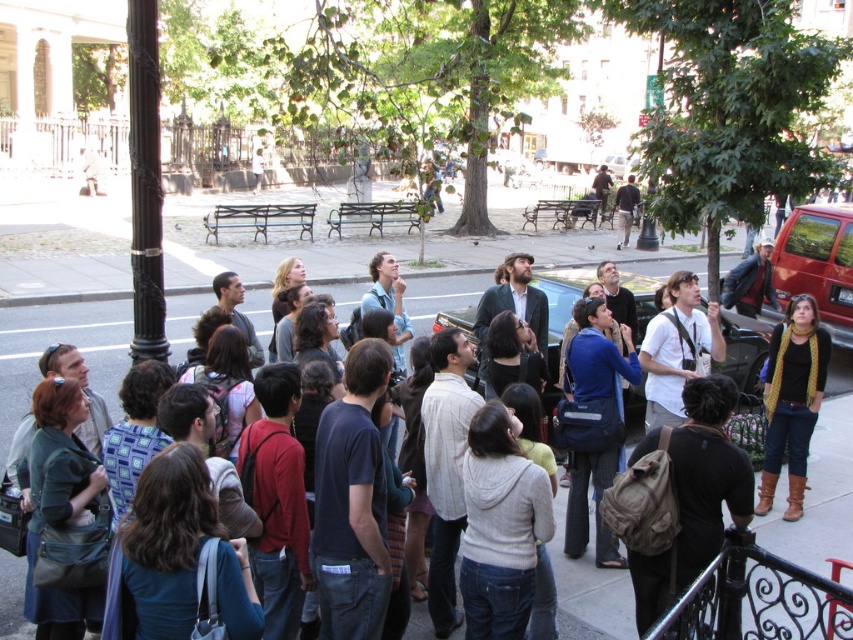
Question: Which point is farther to the camera?

Choices:
 (A) gray concrete pavement at center
 (B) knitted yellow scarf at center

Answer: (B)

Question: Which of the following is the closest to the observer?

Choices:
 (A) (773, 346)
 (B) (590, 634)

Answer: (B)

Question: Can you confirm if gray concrete pavement at center is wider than knitted yellow scarf at center?

Choices:
 (A) yes
 (B) no

Answer: (A)

Question: From the image, what is the correct spatial relationship of gray concrete pavement at center in relation to knitted yellow scarf at center?

Choices:
 (A) left
 (B) right

Answer: (A)

Question: Observing the image, what is the correct spatial positioning of gray concrete pavement at center in reference to knitted yellow scarf at center?

Choices:
 (A) left
 (B) right

Answer: (A)